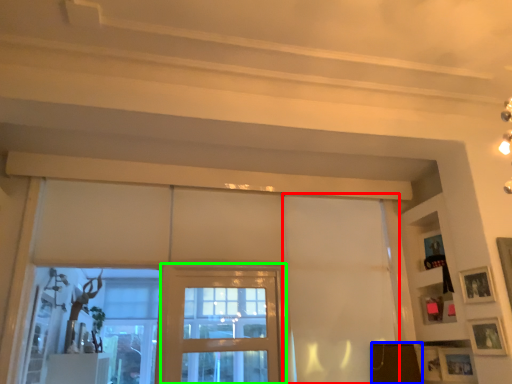
Question: Which object is the farthest from curtain (highlighted by a red box)? Choose among these: furniture (highlighted by a blue box) or screen door (highlighted by a green box).

Choices:
 (A) furniture
 (B) screen door

Answer: (B)